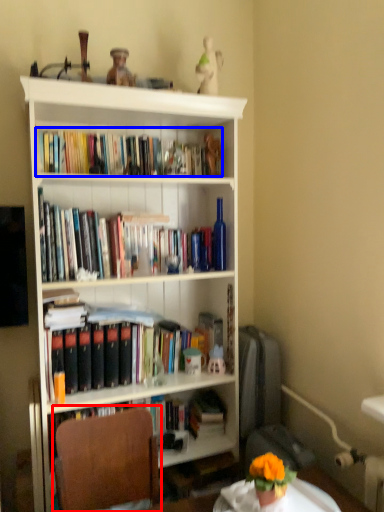
Question: Which of the following is the farthest to the observer, chair (highlighted by a red box) or book (highlighted by a blue box)?

Choices:
 (A) chair
 (B) book

Answer: (B)